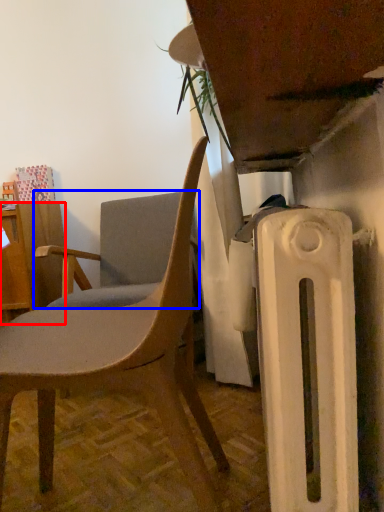
Question: Which of the following is the farthest to the observer, desk (highlighted by a red box) or chair (highlighted by a blue box)?

Choices:
 (A) desk
 (B) chair

Answer: (A)